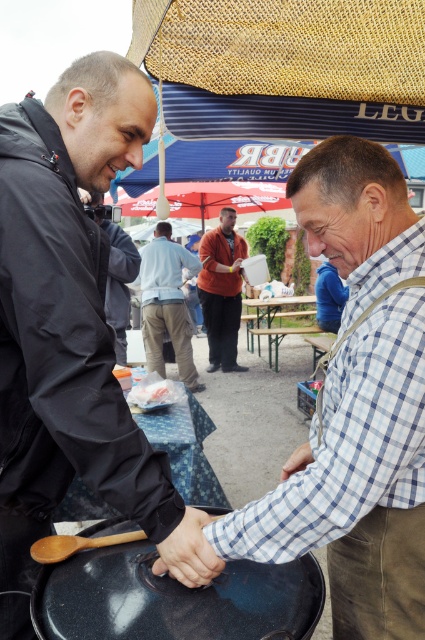
You are a chef trying to place the matte black pan at lower left onto the light blue plaid shirt at center. Will the pan fit without falling off?

The matte black pan at lower left might be wider than light blue plaid shirt at center, so there is a risk it could fall off if placed there.

You are a photographer at the event and want to capture a photo that includes both the matte black pan at lower left and the light blue plaid shirt at center. Which object should you focus on first to ensure both are in the frame?

The matte black pan at lower left is located above the light blue plaid shirt at center, so you should focus on the light blue plaid shirt at center first to ensure both are in the frame.